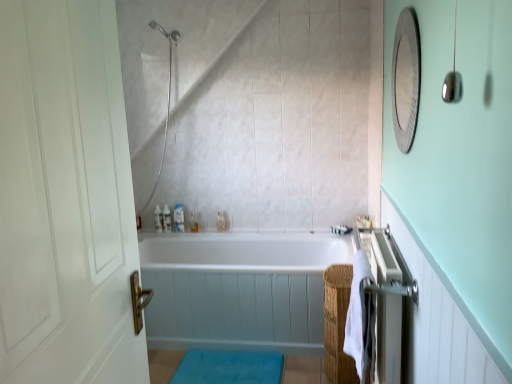
Question: Is silver textured mirror at upper right completely or partially outside of white glossy bathtub at center?

Choices:
 (A) no
 (B) yes

Answer: (B)

Question: From a real-world perspective, does silver textured mirror at upper right stand above white glossy bathtub at center?

Choices:
 (A) no
 (B) yes

Answer: (B)

Question: Can you confirm if silver textured mirror at upper right is wider than white glossy bathtub at center?

Choices:
 (A) yes
 (B) no

Answer: (B)

Question: From the image's perspective, is silver textured mirror at upper right over white glossy bathtub at center?

Choices:
 (A) yes
 (B) no

Answer: (A)

Question: Is silver textured mirror at upper right taller than white glossy bathtub at center?

Choices:
 (A) no
 (B) yes

Answer: (A)

Question: Is silver textured mirror at upper right smaller than white glossy bathtub at center?

Choices:
 (A) no
 (B) yes

Answer: (B)

Question: From a real-world perspective, is silver metallic towel rack at right physically below blue plush bath mat at lower center?

Choices:
 (A) no
 (B) yes

Answer: (A)

Question: Is silver metallic towel rack at right completely or partially outside of blue plush bath mat at lower center?

Choices:
 (A) yes
 (B) no

Answer: (A)

Question: Can you confirm if silver metallic towel rack at right is taller than blue plush bath mat at lower center?

Choices:
 (A) no
 (B) yes

Answer: (B)

Question: Is silver metallic towel rack at right at the left side of blue plush bath mat at lower center?

Choices:
 (A) yes
 (B) no

Answer: (B)

Question: Is silver metallic towel rack at right looking in the opposite direction of blue plush bath mat at lower center?

Choices:
 (A) yes
 (B) no

Answer: (B)

Question: From the image's perspective, is silver metallic towel rack at right beneath blue plush bath mat at lower center?

Choices:
 (A) yes
 (B) no

Answer: (B)

Question: From the image's perspective, would you say translucent plastic bottles at upper center, positioned as the 2th toiletry in left-to-right order, is positioned over white glossy bottle at upper center, which ranks as the 2th toiletry in right-to-left order?

Choices:
 (A) yes
 (B) no

Answer: (A)